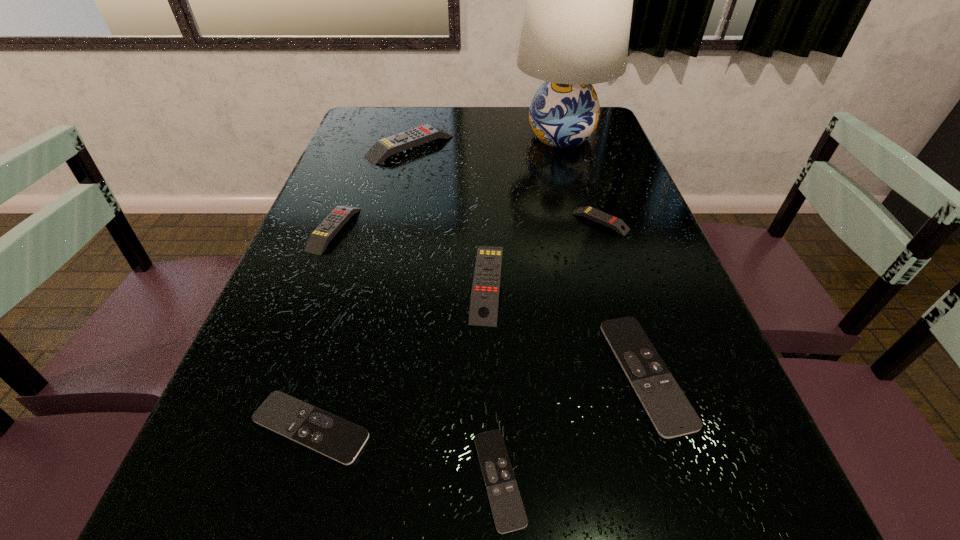
Locate an element on the screen. This screenshot has height=540, width=960. free space located on the left of the sixth shortest object is located at coordinates (315, 282).

Where is `vacant space located on the right of the fourth tallest object`? This screenshot has width=960, height=540. vacant space located on the right of the fourth tallest object is located at coordinates (515, 229).

At what (x,y) coordinates should I click in order to perform the action: click on vacant space located 0.270m on the back of the fourth tallest remote control. Please return your answer as a coordinate pair (x, y). This screenshot has width=960, height=540. Looking at the image, I should click on (579, 156).

This screenshot has height=540, width=960. Find the location of `free location located 0.200m on the left of the biggest black remote control`. free location located 0.200m on the left of the biggest black remote control is located at coordinates (497, 374).

Where is `vacant region located on the right of the leftmost black remote control`? The image size is (960, 540). vacant region located on the right of the leftmost black remote control is located at coordinates (415, 428).

Locate an element on the screen. This screenshot has width=960, height=540. vacant space situated on the left of the shortest remote control is located at coordinates point(228,479).

I want to click on lampshade that is at the far edge, so click(x=576, y=27).

You are a GUI agent. You are given a task and a screenshot of the screen. Output one action in this format:
    pyautogui.click(x=<x>, y=<y>)
    Task: Click on the remote control that is at the far edge
    The height and width of the screenshot is (540, 960).
    Given the screenshot: What is the action you would take?
    pyautogui.click(x=382, y=149)

Find the location of `object situated at the near edge`. object situated at the near edge is located at coordinates (509, 515).

Locate an element on the screen. The height and width of the screenshot is (540, 960). lampshade that is at the right edge is located at coordinates (576, 27).